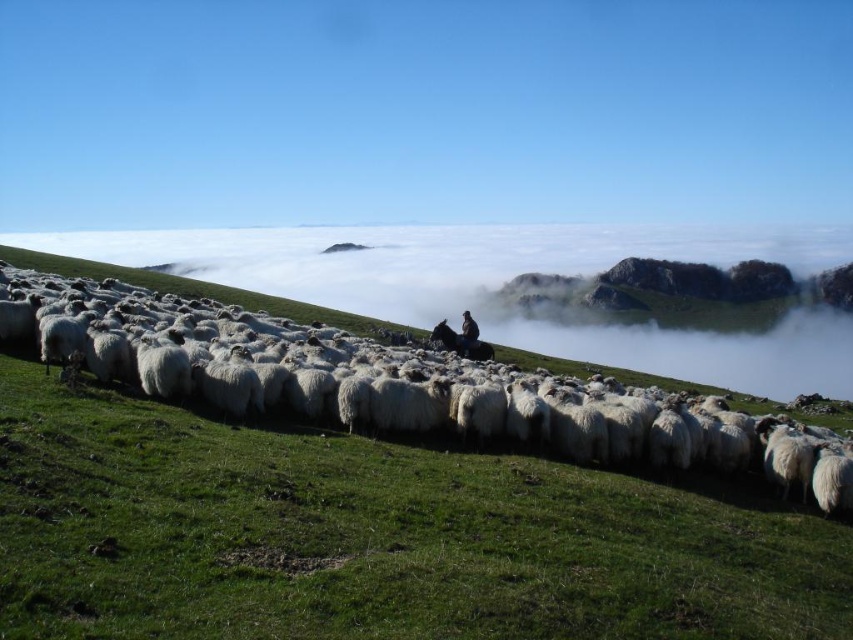
Question: Which of the following is the closest to the observer?

Choices:
 (A) white fluffy wool at center
 (B) dark brown fur at center

Answer: (A)

Question: Is white fluffy wool at center smaller than dark brown fur at center?

Choices:
 (A) yes
 (B) no

Answer: (B)

Question: Among these points, which one is nearest to the camera?

Choices:
 (A) (457, 333)
 (B) (416, 355)

Answer: (B)

Question: Can you confirm if white fluffy wool at center is bigger than dark brown fur at center?

Choices:
 (A) no
 (B) yes

Answer: (B)

Question: Does white fluffy wool at center have a greater width compared to dark brown fur at center?

Choices:
 (A) yes
 (B) no

Answer: (A)